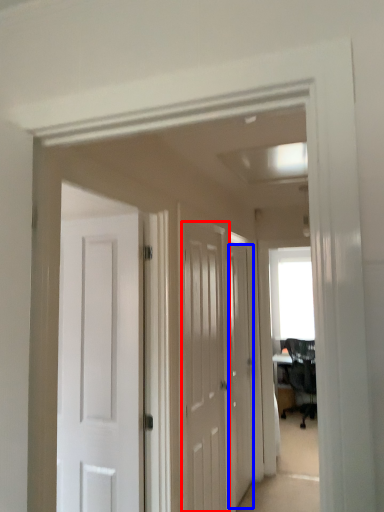
Question: Which of the following is the closest to the observer, door (highlighted by a red box) or door (highlighted by a blue box)?

Choices:
 (A) door
 (B) door

Answer: (A)